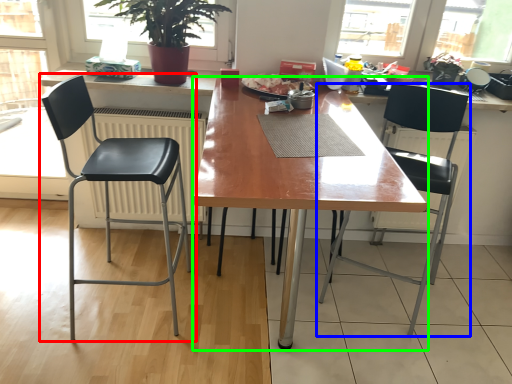
Question: Estimate the real-world distances between objects in this image. Which object is closer to chair (highlighted by a red box), chair (highlighted by a blue box) or desk (highlighted by a green box)?

Choices:
 (A) chair
 (B) desk

Answer: (B)